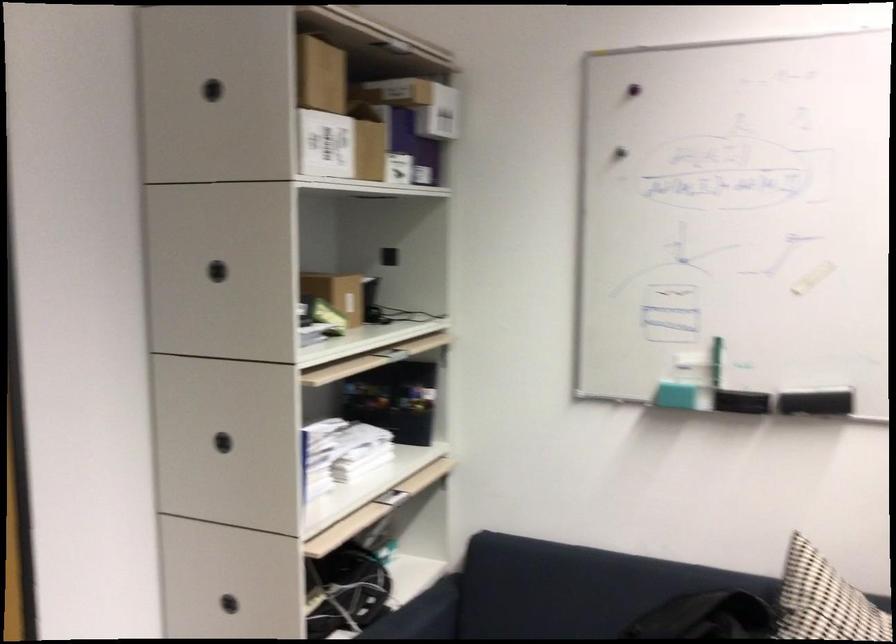
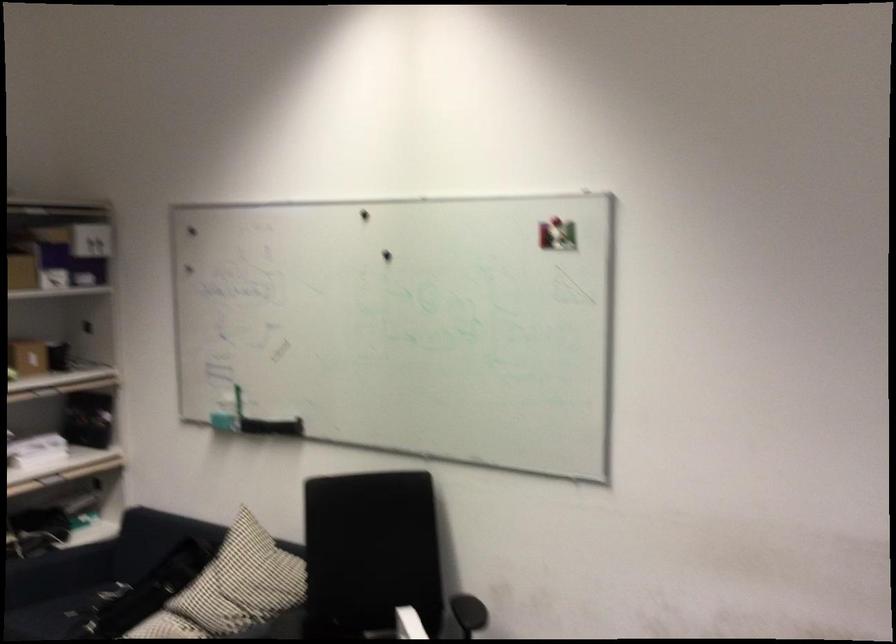
What movement of the cameraman would produce the second image?

The cameraman walked toward right, backward.